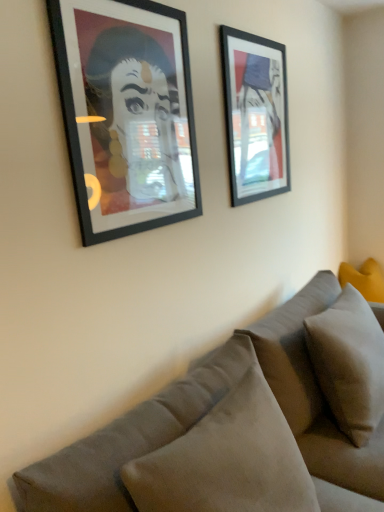
Question: Would you consider velvet gray couch at lower right to be distant from yellow fabric pillow at right, the first pillow when ordered from back to front?

Choices:
 (A) yes
 (B) no

Answer: (A)

Question: From a real-world perspective, is velvet gray couch at lower right on yellow fabric pillow at right, placed as the third pillow when sorted from front to back?

Choices:
 (A) no
 (B) yes

Answer: (A)

Question: Is velvet gray couch at lower right looking in the opposite direction of yellow fabric pillow at right, which is counted as the third pillow, starting from the left?

Choices:
 (A) no
 (B) yes

Answer: (A)

Question: Considering the relative sizes of velvet gray couch at lower right and yellow fabric pillow at right, arranged as the 1th pillow when viewed from the right, in the image provided, is velvet gray couch at lower right wider than yellow fabric pillow at right, arranged as the 1th pillow when viewed from the right,?

Choices:
 (A) no
 (B) yes

Answer: (B)

Question: Is velvet gray couch at lower right positioned behind yellow fabric pillow at right, the first pillow when ordered from back to front?

Choices:
 (A) no
 (B) yes

Answer: (A)

Question: In terms of height, does suede-like beige pillow at lower right, which ranks as the first pillow in front-to-back order, look taller or shorter compared to yellow fabric pillow at right, which is counted as the third pillow, starting from the left?

Choices:
 (A) tall
 (B) short

Answer: (A)

Question: Is suede-like beige pillow at lower right, arranged as the first pillow when viewed from the left, bigger or smaller than yellow fabric pillow at right, which is counted as the third pillow, starting from the left?

Choices:
 (A) big
 (B) small

Answer: (A)

Question: In the image, is suede-like beige pillow at lower right, which appears as the third pillow when viewed from the back, positioned in front of or behind yellow fabric pillow at right, which is counted as the third pillow, starting from the left?

Choices:
 (A) front
 (B) behind

Answer: (A)

Question: Considering the positions of suede-like beige pillow at lower right, which ranks as the first pillow in front-to-back order, and yellow fabric pillow at right, arranged as the 1th pillow when viewed from the right, in the image, is suede-like beige pillow at lower right, which ranks as the first pillow in front-to-back order, wider or thinner than yellow fabric pillow at right, arranged as the 1th pillow when viewed from the right,?

Choices:
 (A) thin
 (B) wide

Answer: (B)

Question: From the image's perspective, is suede-like beige pillow at lower right, which ranks as the first pillow in front-to-back order, above or below matte black picture frame at left, the first picture frame viewed from the front?

Choices:
 (A) below
 (B) above

Answer: (A)

Question: Considering the positions of point (203, 417) and point (193, 181), is point (203, 417) closer or farther from the camera than point (193, 181)?

Choices:
 (A) farther
 (B) closer

Answer: (B)

Question: In terms of size, does suede-like beige pillow at lower right, which is counted as the third pillow, starting from the right, appear bigger or smaller than matte black picture frame at left, acting as the 2th picture frame starting from the right?

Choices:
 (A) big
 (B) small

Answer: (A)

Question: From a real-world perspective, relative to matte black picture frame at left, acting as the 2th picture frame starting from the right, is suede-like beige pillow at lower right, which is counted as the third pillow, starting from the right, vertically above or below?

Choices:
 (A) below
 (B) above

Answer: (A)

Question: In terms of width, does matte black picture frame at upper right, the second picture frame when ordered from left to right, look wider or thinner when compared to velvet gray couch at lower right?

Choices:
 (A) wide
 (B) thin

Answer: (B)

Question: From a real-world perspective, is matte black picture frame at upper right, placed as the second picture frame when sorted from front to back, positioned above or below velvet gray couch at lower right?

Choices:
 (A) above
 (B) below

Answer: (A)